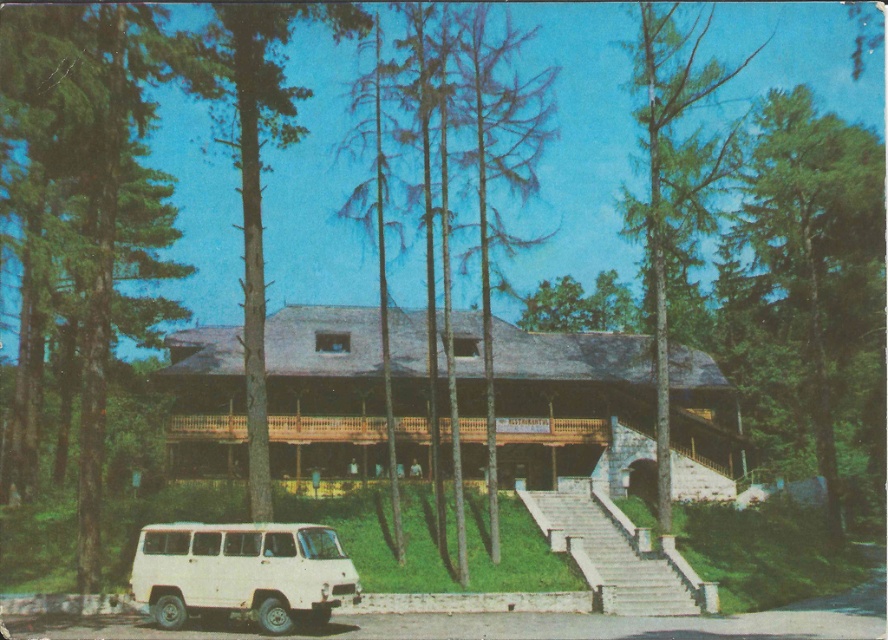
How distant is white matte van at lower left from green leafy tree at center?

white matte van at lower left is 50.96 meters away from green leafy tree at center.

Measure the distance between white matte van at lower left and camera.

22.72 meters

Is point (327, 580) positioned before point (460, 76)?

That is True.

Find the location of a particular element. white matte van at lower left is located at coordinates (242, 572).

Is green leafy tree at center below green textured tree at center?

Correct, green leafy tree at center is located below green textured tree at center.

Between green leafy tree at center and green textured tree at center, which one has less height?

green leafy tree at center

Who is more forward, [522,113] or [666,326]?

Point [666,326] is more forward.

The image size is (888, 640). Find the location of `green leafy tree at center`. green leafy tree at center is located at coordinates (497, 163).

Which is more to the left, green wood tree at center or green textured tree at center?

From the viewer's perspective, green wood tree at center appears more on the left side.

Measure the distance between green wood tree at center and green textured tree at center.

green wood tree at center and green textured tree at center are 26.70 meters apart.

Is point (278, 64) closer to viewer compared to point (712, 88)?

No, it is not.

Where is `green wood tree at center`? green wood tree at center is located at coordinates (x=263, y=170).